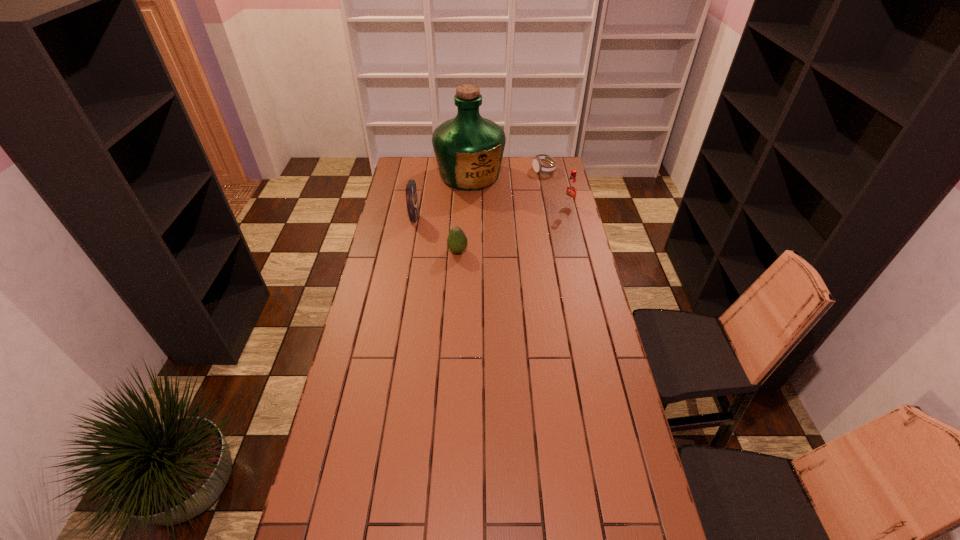
Locate an element on the screen. avocado is located at coordinates (457, 242).

You are a GUI agent. You are given a task and a screenshot of the screen. Output one action in this format:
    pyautogui.click(x=<x>, y=<y>)
    Task: Click on the nearest object
    This screenshot has width=960, height=540.
    Given the screenshot: What is the action you would take?
    pyautogui.click(x=457, y=242)

I want to click on root beer, so click(x=570, y=191).

In order to click on cellular telephone in this screenshot , I will do `click(411, 190)`.

Image resolution: width=960 pixels, height=540 pixels. What are the coordinates of `the leftmost object` in the screenshot? It's located at coord(411,190).

Identify the location of the shortest object. (538, 166).

In order to click on liquor in this screenshot , I will do `click(468, 148)`.

Where is `vacant position located on the front of the second shortest object`? Image resolution: width=960 pixels, height=540 pixels. vacant position located on the front of the second shortest object is located at coordinates (454, 326).

The width and height of the screenshot is (960, 540). Find the location of `vacant region located on the front of the root beer`. vacant region located on the front of the root beer is located at coordinates (579, 251).

Find the location of a particular element. vacant space located on the front face of the cellular telephone is located at coordinates [x=436, y=220].